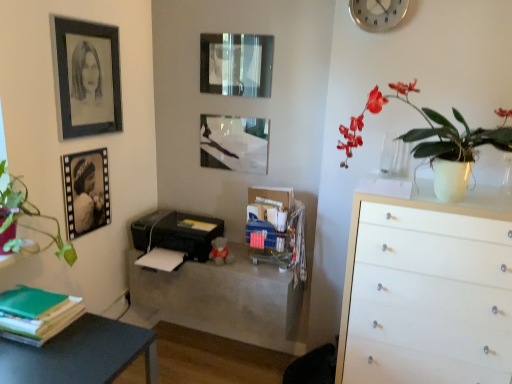
Describe the element at coordinates (234, 143) in the screenshot. This screenshot has width=512, height=384. I see `matte black picture frame at center, which is counted as the 3th picture frame, starting from the left` at that location.

What do you see at coordinates (38, 315) in the screenshot?
I see `green matte book at lower left` at bounding box center [38, 315].

Where is `silver metallic clock at upper right`? silver metallic clock at upper right is located at coordinates (377, 13).

From a real-world perspective, is matte black picture frame at upper center, marked as the fourth picture frame in a left-to-right arrangement, above or below matte black printer at center?

matte black picture frame at upper center, marked as the fourth picture frame in a left-to-right arrangement, is above matte black printer at center.

Is there a large distance between matte black picture frame at upper center, placed as the first picture frame when sorted from right to left, and matte black printer at center?

Absolutely, matte black picture frame at upper center, placed as the first picture frame when sorted from right to left, is distant from matte black printer at center.

From the image's perspective, between matte black picture frame at upper center, placed as the first picture frame when sorted from right to left, and matte black printer at center, who is located below?

matte black printer at center appears lower in the image.

From the image's perspective, which picture frame is the 4th one above the matte black printer at center? Please provide its 2D coordinates.

[(236, 64)]

Could you tell me if black plastic printer at center is facing matte white vase at upper right?

No, black plastic printer at center is not facing towards matte white vase at upper right.

In the scene shown: Is black plastic printer at center smaller than matte white vase at upper right?

Yes, black plastic printer at center is smaller than matte white vase at upper right.

From a real-world perspective, which object rests below the other?

black plastic printer at center, from a real-world perspective.

Would you say black plastic printer at center is a long distance from matte white vase at upper right?

Absolutely, black plastic printer at center is distant from matte white vase at upper right.

From the image's perspective, is black plastic printer at center located above or below matte black picture frame at upper left, which is counted as the third picture frame, starting from the right?

From the image's perspective, black plastic printer at center appears below matte black picture frame at upper left, which is counted as the third picture frame, starting from the right.

From a real-world perspective, count 3rd picture frames upward from the black plastic printer at center and point to it. Please provide its 2D coordinates.

[(86, 77)]

From a real-world perspective, who is located lower, black plastic printer at center or matte black picture frame at upper left, which is counted as the third picture frame, starting from the right?

black plastic printer at center is physically lower.

Would you say matte black printer at center is a long distance from white wood chest of drawers at right?

matte black printer at center is near white wood chest of drawers at right, not far away.

Locate an element on the screen. the chest of drawers above the matte black printer at center (from a real-world perspective) is located at coordinates (428, 290).

Which object is thinner, matte black printer at center or white wood chest of drawers at right?

Thinner between the two is matte black printer at center.

Is point (215, 279) closer or farther from the camera than point (406, 321)?

Point (215, 279).

From the image's perspective, who appears lower, matte black picture frame at center, which appears as the second picture frame when viewed from the right, or black matte photo frame at left, which ranks as the first picture frame in left-to-right order?

black matte photo frame at left, which ranks as the first picture frame in left-to-right order.

Considering the relative sizes of matte black picture frame at center, which appears as the second picture frame when viewed from the right, and black matte photo frame at left, which ranks as the first picture frame in left-to-right order, in the image provided, is matte black picture frame at center, which appears as the second picture frame when viewed from the right, taller than black matte photo frame at left, which ranks as the first picture frame in left-to-right order,?

No, matte black picture frame at center, which appears as the second picture frame when viewed from the right, is not taller than black matte photo frame at left, which ranks as the first picture frame in left-to-right order.

This screenshot has width=512, height=384. Find the location of `table below the matte black picture frame at upper left, which is counted as the third picture frame, starting from the right (from the image's perspective)`. table below the matte black picture frame at upper left, which is counted as the third picture frame, starting from the right (from the image's perspective) is located at coordinates (223, 297).

Based on the photo, between matte black printer at center and matte black picture frame at upper left, which is counted as the third picture frame, starting from the right, which one has smaller width?

matte black picture frame at upper left, which is counted as the third picture frame, starting from the right, is thinner.

In the scene shown: Looking at the image, does matte black printer at center seem bigger or smaller compared to matte black picture frame at upper left, which is counted as the third picture frame, starting from the right?

Clearly, matte black printer at center is larger in size than matte black picture frame at upper left, which is counted as the third picture frame, starting from the right.

Looking at this image, from a real-world perspective, who is located lower, matte black printer at center or matte black picture frame at upper left, the 2th picture frame positioned from the left?

matte black printer at center is physically lower.

Can you confirm if black matte photo frame at left, which ranks as the first picture frame in left-to-right order, is taller than matte black picture frame at upper center, placed as the first picture frame when sorted from right to left?

Yes, black matte photo frame at left, which ranks as the first picture frame in left-to-right order, is taller than matte black picture frame at upper center, placed as the first picture frame when sorted from right to left.

Is black matte photo frame at left, which is the fourth picture frame in right-to-left order, wider or thinner than matte black picture frame at upper center, marked as the fourth picture frame in a left-to-right arrangement?

Considering their sizes, black matte photo frame at left, which is the fourth picture frame in right-to-left order, looks broader than matte black picture frame at upper center, marked as the fourth picture frame in a left-to-right arrangement.

Which object is positioned more to the left, black matte photo frame at left, which ranks as the first picture frame in left-to-right order, or matte black picture frame at upper center, placed as the first picture frame when sorted from right to left?

black matte photo frame at left, which ranks as the first picture frame in left-to-right order, is more to the left.

The height and width of the screenshot is (384, 512). What are the coordinates of `table that appears on the left of matte black picture frame at upper center, marked as the fourth picture frame in a left-to-right arrangement` in the screenshot? It's located at (223, 297).

Where is `flower located above the black plastic printer at center (from the image's perspective)`? flower located above the black plastic printer at center (from the image's perspective) is located at coordinates (433, 136).

Which object lies nearer to the anchor point matte white vase at upper right, white wood chest of drawers at right or matte black picture frame at upper center, placed as the first picture frame when sorted from right to left?

Based on the image, white wood chest of drawers at right appears to be nearer to matte white vase at upper right.

Estimate the real-world distances between objects in this image. Which object is closer to white wood chest of drawers at right, green matte book at lower left or black plastic printer at center?

black plastic printer at center lies closer to white wood chest of drawers at right than the other object.

Looking at the image, which one is located closer to white wood chest of drawers at right, green matte book at lower left or matte black printer at center?

Among the two, matte black printer at center is located nearer to white wood chest of drawers at right.

Based on their spatial positions, is matte black picture frame at center, which appears as the second picture frame when viewed from the right, or black plastic printer at center further from silver metallic clock at upper right?

black plastic printer at center is positioned further to the anchor silver metallic clock at upper right.

Which object lies further to the anchor point matte black picture frame at center, which appears as the second picture frame when viewed from the right, black plastic printer at center or matte white vase at upper right?

matte white vase at upper right lies further to matte black picture frame at center, which appears as the second picture frame when viewed from the right, than the other object.

When comparing their distances from silver metallic clock at upper right, does white wood chest of drawers at right or matte white vase at upper right seem closer?

Among the two, matte white vase at upper right is located nearer to silver metallic clock at upper right.

Which object lies further to the anchor point matte white vase at upper right, white wood chest of drawers at right or matte black picture frame at center, which appears as the second picture frame when viewed from the right?

The object further to matte white vase at upper right is matte black picture frame at center, which appears as the second picture frame when viewed from the right.

When comparing their distances from matte black printer at center, does green matte book at lower left or matte black picture frame at upper left, which is counted as the third picture frame, starting from the right, seem closer?

The object closer to matte black printer at center is green matte book at lower left.

Locate an element on the screen. flower between silver metallic clock at upper right and matte black printer at center from top to bottom is located at coordinates (433, 136).

Where is `printer between matte black picture frame at upper left, which is counted as the third picture frame, starting from the right, and matte black printer at center from top to bottom`? This screenshot has height=384, width=512. printer between matte black picture frame at upper left, which is counted as the third picture frame, starting from the right, and matte black printer at center from top to bottom is located at coordinates (177, 233).

Locate an element on the screen. book between matte black picture frame at upper left, which is counted as the third picture frame, starting from the right, and matte black printer at center, in the vertical direction is located at coordinates (38, 315).

Where is `table between green matte book at lower left and matte white vase at upper right`? The width and height of the screenshot is (512, 384). table between green matte book at lower left and matte white vase at upper right is located at coordinates (223, 297).